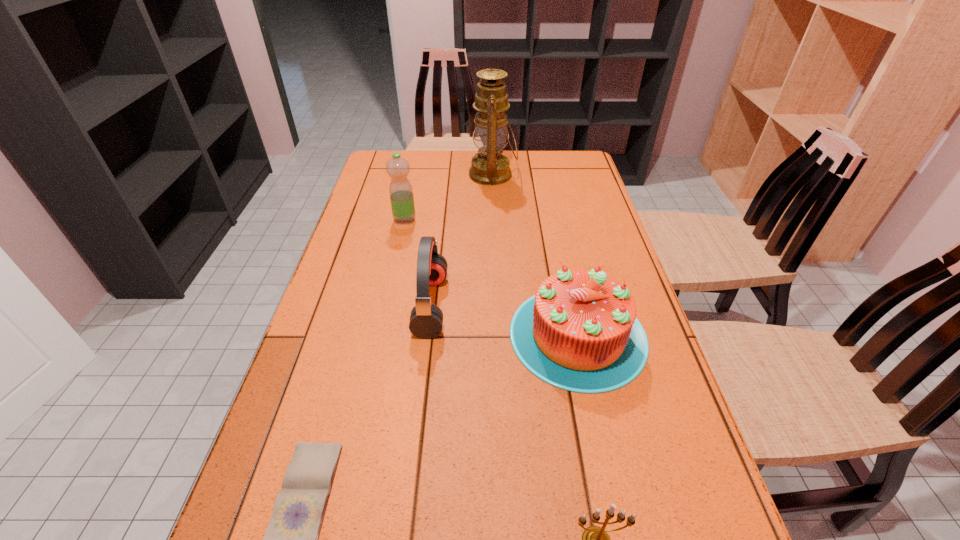
At what (x,y) coordinates should I click in order to perform the action: click on object that is the third nearest to the third object from left to right. Please return your answer as a coordinate pair (x, y). Image resolution: width=960 pixels, height=540 pixels. Looking at the image, I should click on (291, 539).

You are a GUI agent. You are given a task and a screenshot of the screen. Output one action in this format:
    pyautogui.click(x=<x>, y=<y>)
    Task: Click on the vacant space that satisfies the following two spatial constraints: 1. on the ear cups of the fourth object from right to left; 2. on the left side of the cake
    
    Given the screenshot: What is the action you would take?
    pyautogui.click(x=427, y=335)